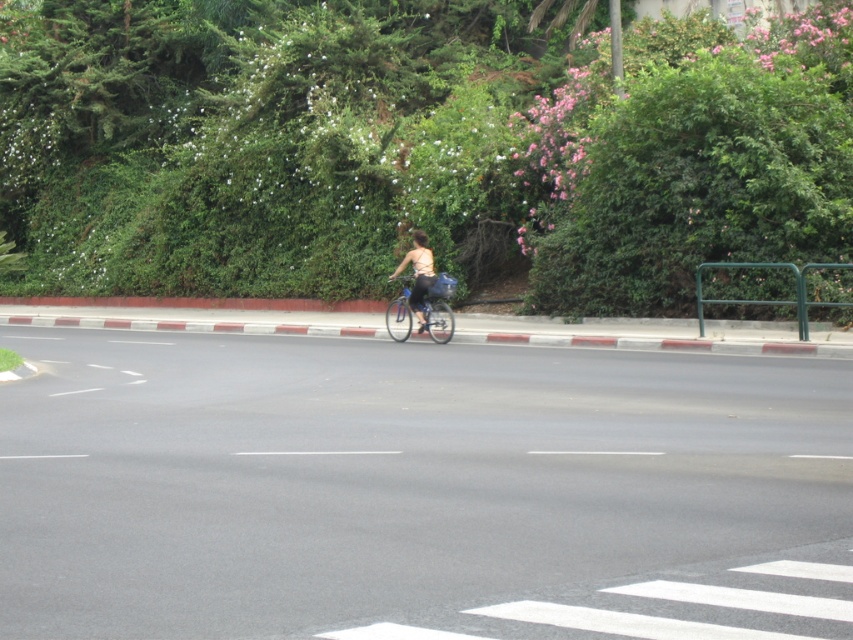
You are a pedestrian standing on the sidewalk next to the green metal railing. You want to cross the street to reach the pedestrian crossing at the bottom right corner. Which direction should you walk to avoid the shiny metallic bicycle at center and the matte beige tank top at center?

You should walk to the right of both the shiny metallic bicycle at center and the matte beige tank top at center since the bicycle is to the left of the tank top, so moving right would take you around them towards the pedestrian crossing.